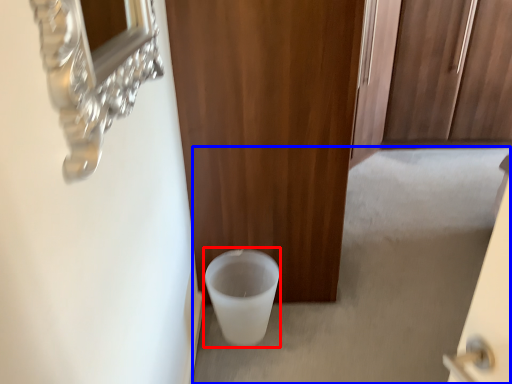
Question: Which of the following is the farthest to the observer, toilet bowl (highlighted by a red box) or concrete (highlighted by a blue box)?

Choices:
 (A) toilet bowl
 (B) concrete

Answer: (B)